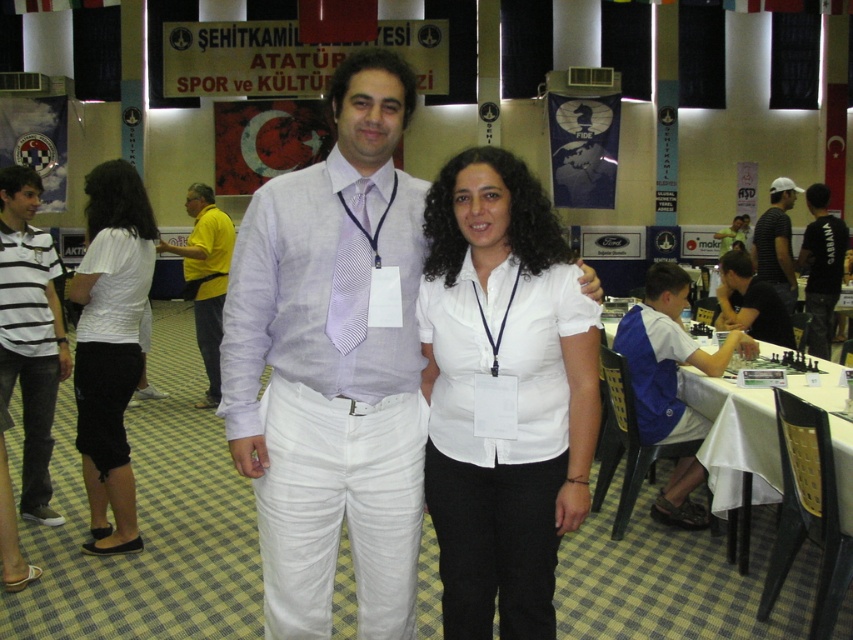
Looking at this image, between white cloth-covered table at right and white striped shirt at center, which one appears on the right side from the viewer's perspective?

white striped shirt at center is more to the right.

Who is more distant from viewer, [833,374] or [786,301]?

The point [786,301] is more distant.

Find the location of `white cloth-covered table at right`. white cloth-covered table at right is located at coordinates (735, 448).

Is point (347, 246) closer to viewer compared to point (838, 237)?

Yes.

Who is more distant from viewer, (347, 321) or (805, 237)?

The point (805, 237) is more distant.

Image resolution: width=853 pixels, height=640 pixels. What do you see at coordinates (350, 272) in the screenshot? I see `lavender striped tie at center` at bounding box center [350, 272].

At what (x,y) coordinates should I click in order to perform the action: click on lavender striped tie at center. Please return your answer as a coordinate pair (x, y). The width and height of the screenshot is (853, 640). Looking at the image, I should click on (350, 272).

Can you confirm if white striped shirt at left is smaller than black cotton t-shirt at right?

Yes.

Is point (36, 502) behind point (843, 232)?

No, it is not.

Identify the location of white striped shirt at left. (30, 332).